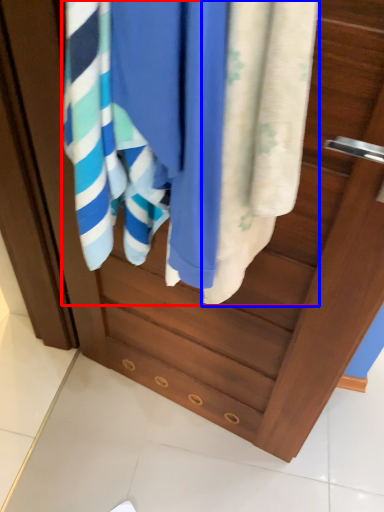
Question: Which point is further to the camera, bath towel (highlighted by a red box) or towel (highlighted by a blue box)?

Choices:
 (A) bath towel
 (B) towel

Answer: (A)